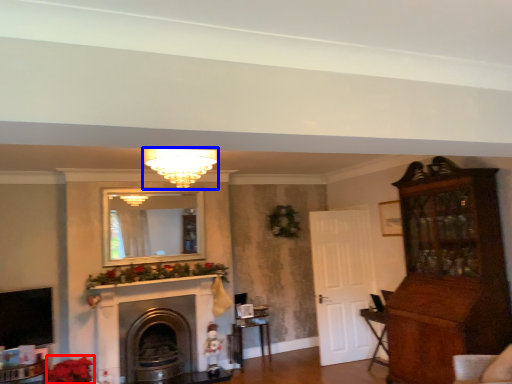
Question: Among these objects, which one is nearest to the camera, flower (highlighted by a red box) or light fixture (highlighted by a blue box)?

Choices:
 (A) flower
 (B) light fixture

Answer: (B)